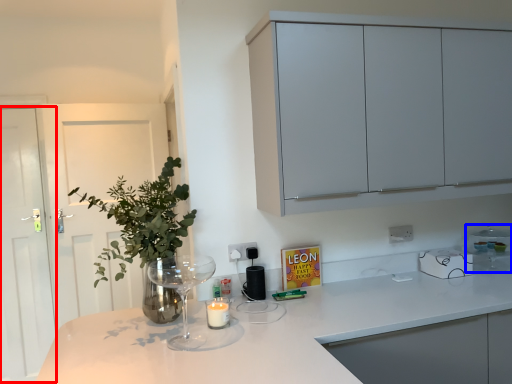
Question: Among these objects, which one is farthest to the camera, glass door (highlighted by a red box) or appliance (highlighted by a blue box)?

Choices:
 (A) glass door
 (B) appliance

Answer: (A)